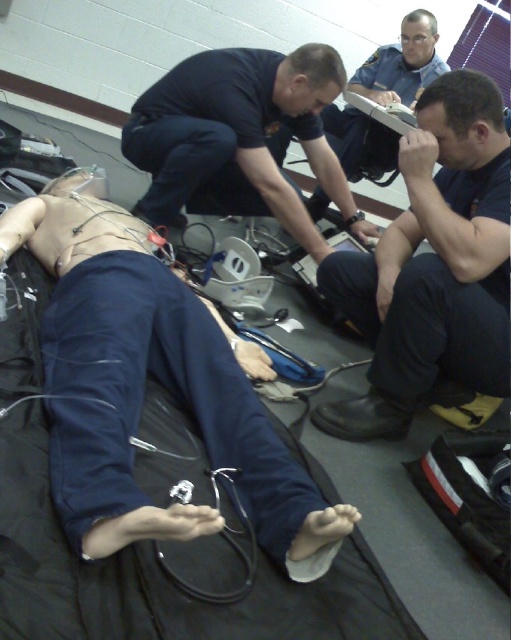
Question: Is black matte uniform at center positioned before dark blue uniform at center?

Choices:
 (A) yes
 (B) no

Answer: (A)

Question: Among these points, which one is nearest to the camera?

Choices:
 (A) (98, 316)
 (B) (322, 285)

Answer: (A)

Question: Is blue fabric at lower left further to the viewer compared to black matte uniform at center?

Choices:
 (A) yes
 (B) no

Answer: (B)

Question: Which is nearer to the blue fabric at lower left?

Choices:
 (A) dark blue uniform at center
 (B) black matte uniform at center

Answer: (B)

Question: Can you confirm if blue fabric at lower left is positioned above black matte uniform at center?

Choices:
 (A) yes
 (B) no

Answer: (B)

Question: Which is farther from the black matte uniform at center?

Choices:
 (A) blue fabric at lower left
 (B) dark blue uniform at center

Answer: (B)